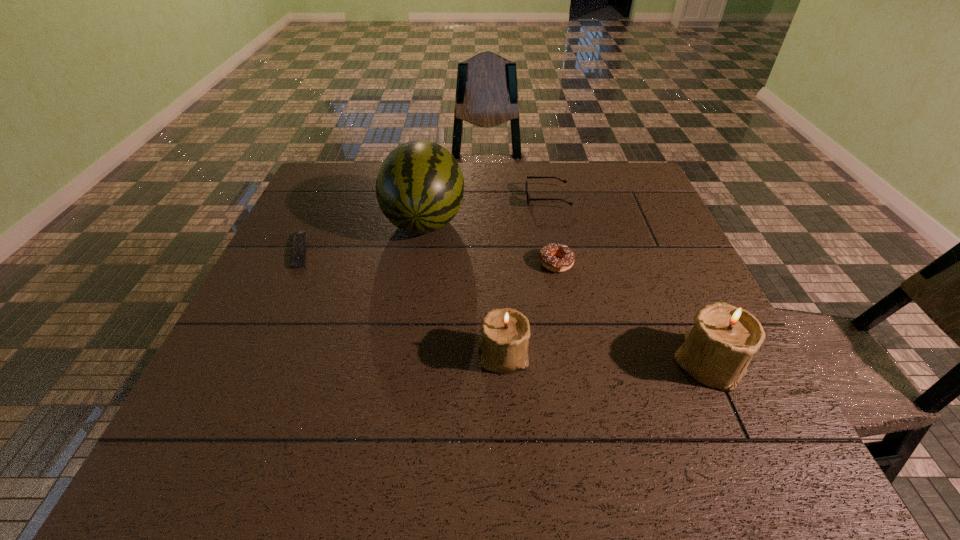
Image resolution: width=960 pixels, height=540 pixels. I want to click on the shorter candle_holder, so click(x=505, y=332).

Image resolution: width=960 pixels, height=540 pixels. I want to click on the third tallest object, so click(x=505, y=332).

Locate an element on the screen. the taller candle_holder is located at coordinates (717, 350).

At what (x,y) coordinates should I click in order to perform the action: click on the fifth shortest object. Please return your answer as a coordinate pair (x, y). The height and width of the screenshot is (540, 960). Looking at the image, I should click on (717, 350).

The width and height of the screenshot is (960, 540). In order to click on sunglasses in this screenshot , I will do `click(529, 199)`.

This screenshot has height=540, width=960. Find the location of `the second object from left to right`. the second object from left to right is located at coordinates (419, 188).

You are a GUI agent. You are given a task and a screenshot of the screen. Output one action in this format:
    pyautogui.click(x=<x>, y=<y>)
    Task: Click on the tallest object
    This screenshot has height=540, width=960.
    Given the screenshot: What is the action you would take?
    pyautogui.click(x=419, y=188)

The image size is (960, 540). Find the location of `the leftmost object`. the leftmost object is located at coordinates (298, 259).

The width and height of the screenshot is (960, 540). I want to click on the shortest object, so click(298, 259).

At what (x,y) coordinates should I click in order to perform the action: click on doughnut. Please return your answer as a coordinate pair (x, y). Image resolution: width=960 pixels, height=540 pixels. Looking at the image, I should click on (548, 254).